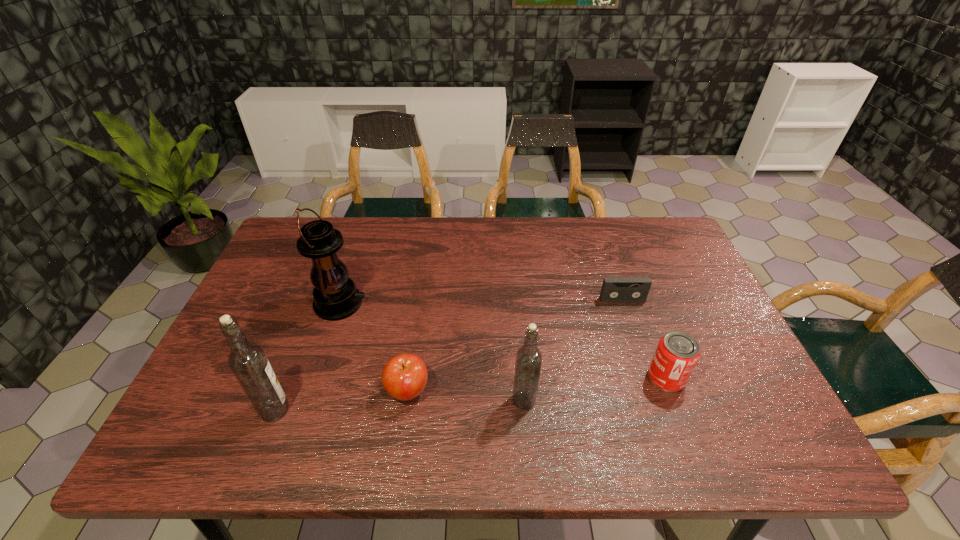
Where is `vacant space at the left edge of the desktop`? vacant space at the left edge of the desktop is located at coordinates (288, 268).

The height and width of the screenshot is (540, 960). I want to click on vacant space at the right edge, so click(749, 375).

In order to click on vacant space at the near left corner of the desktop in this screenshot , I will do `click(233, 409)`.

At what (x,y) coordinates should I click in order to perform the action: click on free space at the far right corner. Please return your answer as a coordinate pair (x, y). Looking at the image, I should click on (664, 257).

Image resolution: width=960 pixels, height=540 pixels. Identify the location of vacant area between the third shortest object and the left vodka. (470, 394).

The image size is (960, 540). Identify the location of free space between the taller vodka and the fourth shortest object. (399, 405).

At what (x,y) coordinates should I click in order to perform the action: click on vacant point located between the videotape and the right vodka. Please return your answer as a coordinate pair (x, y). Looking at the image, I should click on (573, 350).

At what (x,y) coordinates should I click in order to perform the action: click on vacant area that lies between the third object from right to left and the videotape. Please return your answer as a coordinate pair (x, y). Image resolution: width=960 pixels, height=540 pixels. Looking at the image, I should click on (573, 350).

At what (x,y) coordinates should I click in order to perform the action: click on free area in between the lantern and the can. Please return your answer as a coordinate pair (x, y). Looking at the image, I should click on pos(503,341).

In order to click on vacant point located between the left vodka and the fourth object from left to right in this screenshot , I will do `click(399, 405)`.